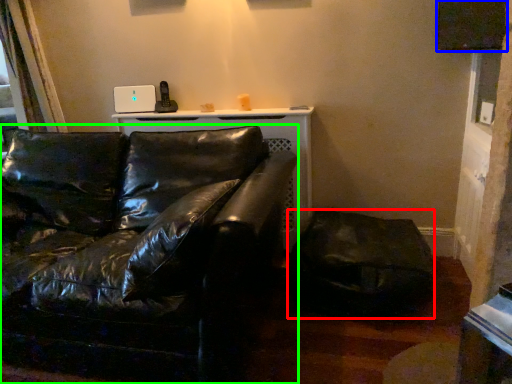
Question: Based on their relative distances, which object is farther from swivel chair (highlighted by a red box)? Choose from window screen (highlighted by a blue box) and studio couch (highlighted by a green box).

Choices:
 (A) window screen
 (B) studio couch

Answer: (A)